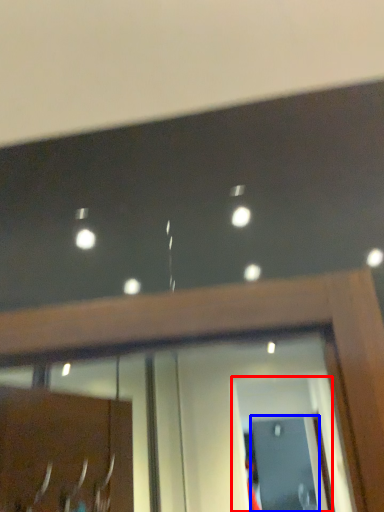
Question: Which object appears closest to the camera in this image, screen door (highlighted by a red box) or screen door (highlighted by a blue box)?

Choices:
 (A) screen door
 (B) screen door

Answer: (A)